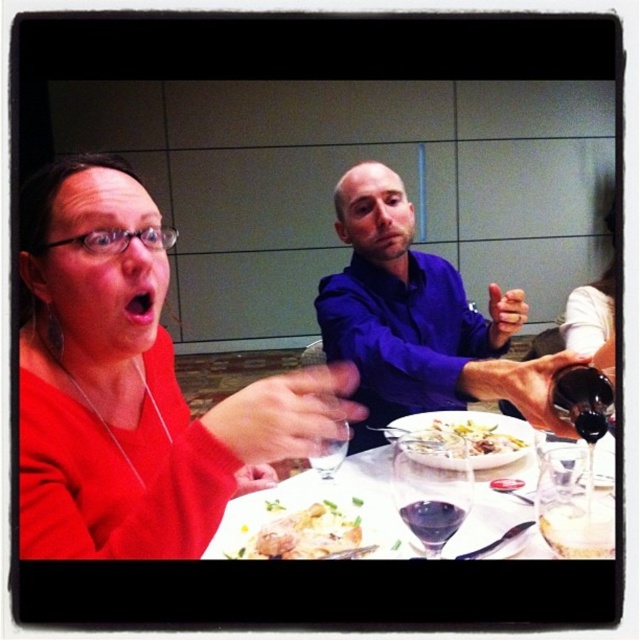
Question: Does white creamy sauce at center have a larger size compared to dark glass bottle at center right?

Choices:
 (A) yes
 (B) no

Answer: (A)

Question: Where is matte red shirt at left located in relation to dark glass bottle at center right in the image?

Choices:
 (A) right
 (B) left

Answer: (B)

Question: Which object is the closest to the transparent glass at lower right?

Choices:
 (A) dark glass wine at lower center
 (B) blue smooth shirt at center
 (C) white creamy pasta at center

Answer: (C)

Question: Which of the following is the closest to the observer?

Choices:
 (A) (497, 449)
 (B) (609, 532)
 (C) (317, 461)
 (D) (580, 396)

Answer: (D)

Question: Which point appears farthest from the camera in this image?

Choices:
 (A) (436, 432)
 (B) (584, 412)
 (C) (550, 470)

Answer: (A)

Question: Does blue smooth shirt at center have a smaller size compared to white creamy sauce at center?

Choices:
 (A) no
 (B) yes

Answer: (A)